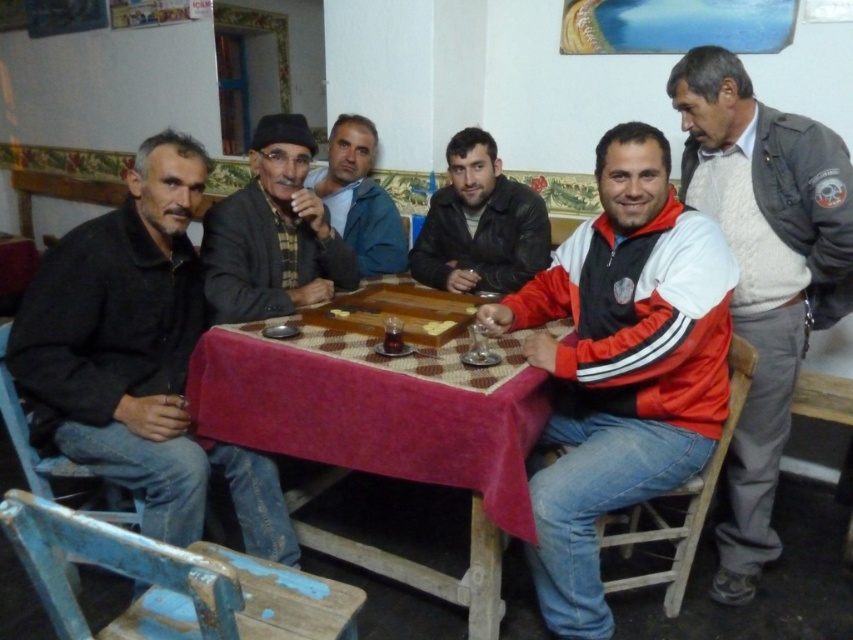
Can you confirm if dark gray knit cap at center is positioned above dark blue fabric at center?

No.

Is point (239, 298) less distant than point (374, 138)?

Yes, point (239, 298) is closer to viewer.

Is point (297, 276) behind point (392, 220)?

That is False.

The height and width of the screenshot is (640, 853). I want to click on dark gray knit cap at center, so tap(273, 234).

Is black matte jacket at left smaller than translucent glass cup at table center?

Incorrect, black matte jacket at left is not smaller in size than translucent glass cup at table center.

Who is more distant from viewer, [44,332] or [397,349]?

The point [397,349] is more distant.

The image size is (853, 640). In order to click on black matte jacket at left in this screenshot , I will do `click(137, 358)`.

Is red and white jacket at center bigger than gray wool sweater at upper right?

Indeed, red and white jacket at center has a larger size compared to gray wool sweater at upper right.

Which is below, red and white jacket at center or gray wool sweater at upper right?

red and white jacket at center is below.

Which is behind, point (593, 580) or point (758, 444)?

Positioned behind is point (758, 444).

The image size is (853, 640). I want to click on red and white jacket at center, so 621,365.